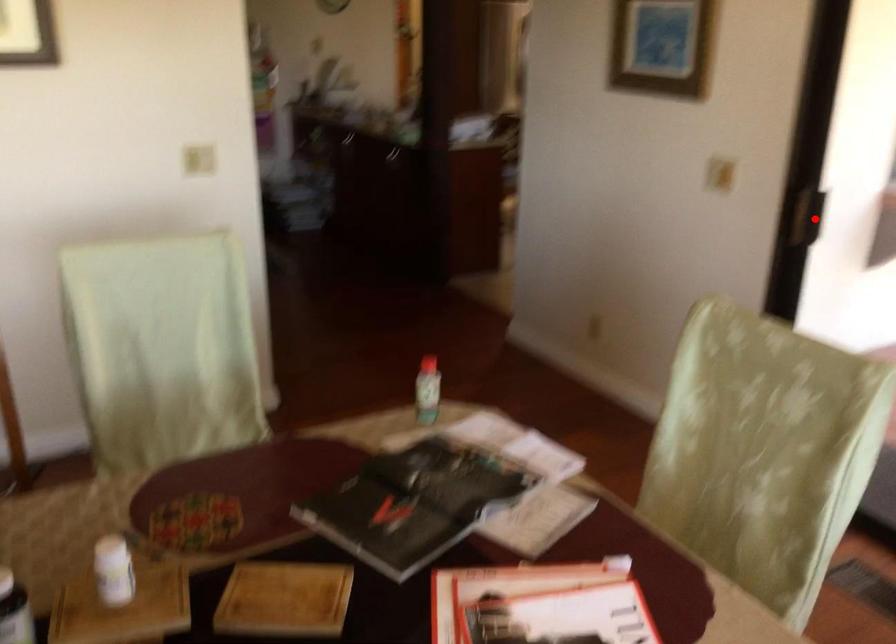
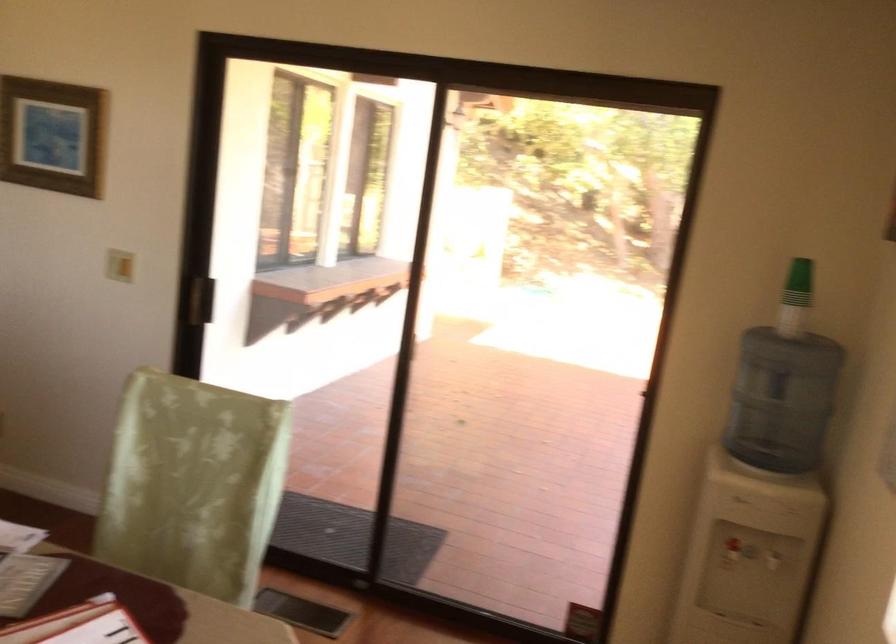
Question: I am providing you with two images of the same scene from different viewpoints. A red point is shown in image1. For the corresponding object point in image2, is it positioned nearer or farther from the camera?

Choices:
 (A) Nearer
 (B) Farther

Answer: (B)